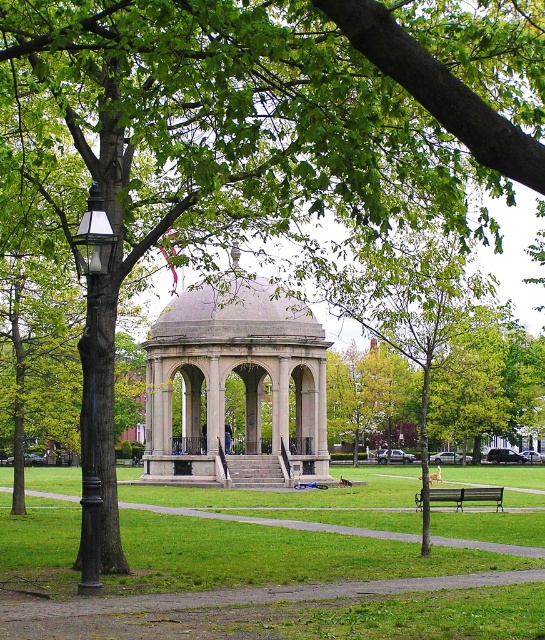
You are standing at the entrance of the gazebo and want to walk towards the point marked as point (x=530, y=560). However, there is an obstacle at point (x=92, y=435). Based on the coordinates provided, will you encounter the obstacle before reaching your destination?

Point (x=530, y=560) is behind point (x=92, y=435), so you will encounter the obstacle at point (x=92, y=435) before reaching your destination.